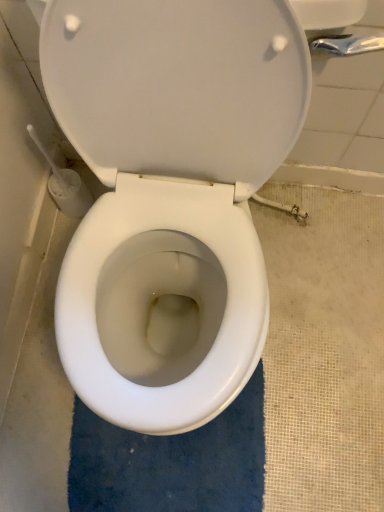
Image resolution: width=384 pixels, height=512 pixels. What do you see at coordinates (170, 193) in the screenshot?
I see `white glossy toilet at center` at bounding box center [170, 193].

You are a GUI agent. You are given a task and a screenshot of the screen. Output one action in this format:
    pyautogui.click(x=<x>, y=<y>)
    Task: Click on the white glossy toilet at center
    This screenshot has height=512, width=384.
    Given the screenshot: What is the action you would take?
    pyautogui.click(x=170, y=193)

Measure the distance between blue plush bath mat at center and camera.

The distance of blue plush bath mat at center from camera is 39.30 inches.

What are the coordinates of `blue plush bath mat at center` in the screenshot? It's located at tap(171, 462).

Describe the element at coordinates (171, 462) in the screenshot. This screenshot has height=512, width=384. I see `blue plush bath mat at center` at that location.

Locate an element on the screen. white glossy toilet at center is located at coordinates (170, 193).

Between white glossy toilet at center and blue plush bath mat at center, which one appears on the right side from the viewer's perspective?

Positioned to the right is white glossy toilet at center.

Which object is closer to the camera, white glossy toilet at center or blue plush bath mat at center?

white glossy toilet at center is closer to the camera.

Which is closer to the camera, (200,209) or (195,475)?

Clearly, point (200,209) is closer to the camera than point (195,475).

From the image's perspective, who appears lower, white glossy toilet at center or blue plush bath mat at center?

blue plush bath mat at center, from the image's perspective.

Based on the photo, from a real-world perspective, between white glossy toilet at center and blue plush bath mat at center, who is vertically higher?

In real-world perspective, white glossy toilet at center is above.

Does white glossy toilet at center have a lesser width compared to blue plush bath mat at center?

In fact, white glossy toilet at center might be wider than blue plush bath mat at center.

Looking at this image, who is shorter, white glossy toilet at center or blue plush bath mat at center?

With less height is blue plush bath mat at center.

Considering the relative sizes of white glossy toilet at center and blue plush bath mat at center in the image provided, is white glossy toilet at center smaller than blue plush bath mat at center?

No.

Which is correct: white glossy toilet at center is inside blue plush bath mat at center, or outside of it?

white glossy toilet at center cannot be found inside blue plush bath mat at center.

Would you say white glossy toilet at center is a long distance from blue plush bath mat at center?

No, white glossy toilet at center is not far away from blue plush bath mat at center.

Is blue plush bath mat at center at the back of white glossy toilet at center?

No, blue plush bath mat at center is not at the back of white glossy toilet at center.

Where is `bath mat that appears behind the white glossy toilet at center`? The height and width of the screenshot is (512, 384). bath mat that appears behind the white glossy toilet at center is located at coordinates (171, 462).

Can you confirm if blue plush bath mat at center is positioned to the right of white glossy toilet at center?

No.

Is blue plush bath mat at center in front of or behind white glossy toilet at center in the image?

Clearly, blue plush bath mat at center is behind white glossy toilet at center.

Which is closer to the camera, (129, 464) or (133, 54)?

Point (129, 464).

From the image's perspective, does blue plush bath mat at center appear lower than white glossy toilet at center?

Yes, from the image's perspective, blue plush bath mat at center is beneath white glossy toilet at center.

From a real-world perspective, which is physically below, blue plush bath mat at center or white glossy toilet at center?

blue plush bath mat at center is physically lower.

Considering the sizes of objects blue plush bath mat at center and white glossy toilet at center in the image provided, who is wider, blue plush bath mat at center or white glossy toilet at center?

Wider between the two is white glossy toilet at center.

Considering the relative sizes of blue plush bath mat at center and white glossy toilet at center in the image provided, is blue plush bath mat at center shorter than white glossy toilet at center?

Yes.

Consider the image. Between blue plush bath mat at center and white glossy toilet at center, which one has smaller size?

blue plush bath mat at center.

Would you say white glossy toilet at center is part of blue plush bath mat at center's contents?

No, white glossy toilet at center is not a part of blue plush bath mat at center.

Looking at this image, are blue plush bath mat at center and white glossy toilet at center beside each other?

No, blue plush bath mat at center is not in contact with white glossy toilet at center.

Could you tell me if blue plush bath mat at center is turned towards white glossy toilet at center?

No, blue plush bath mat at center does not turn towards white glossy toilet at center.

This screenshot has height=512, width=384. I want to click on bath mat located on the left of white glossy toilet at center, so click(171, 462).

The height and width of the screenshot is (512, 384). I want to click on toilet that appears on the right of blue plush bath mat at center, so click(170, 193).

Identify the location of toilet above the blue plush bath mat at center (from the image's perspective). The width and height of the screenshot is (384, 512). (170, 193).